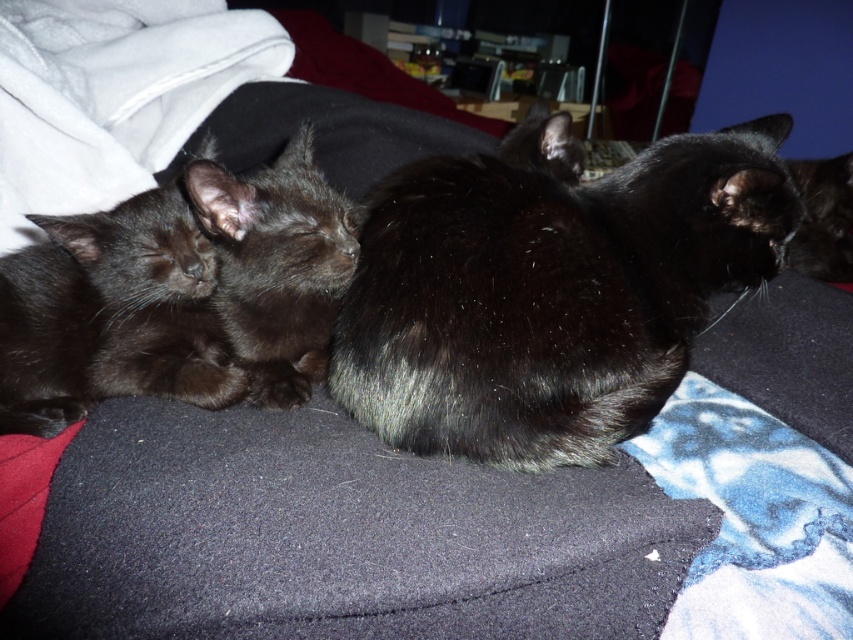
Which of these two, shiny black cat at center or matte black kitten at left, stands shorter?

Standing shorter between the two is matte black kitten at left.

Describe the element at coordinates (550, 292) in the screenshot. I see `shiny black cat at center` at that location.

In order to click on shiny black cat at center in this screenshot , I will do `click(550, 292)`.

Is shiny black cat at center positioned in front of shiny black kitten at center?

Yes, shiny black cat at center is in front of shiny black kitten at center.

Locate an element on the screen. shiny black cat at center is located at coordinates (550, 292).

Where is `shiny black cat at center`? The image size is (853, 640). shiny black cat at center is located at coordinates (550, 292).

Is matte black kitten at left closer to the viewer compared to shiny black kitten at center?

No, matte black kitten at left is further to the viewer.

Does matte black kitten at left have a greater width compared to shiny black kitten at center?

Yes.

What are the coordinates of `matte black kitten at left` in the screenshot? It's located at (111, 316).